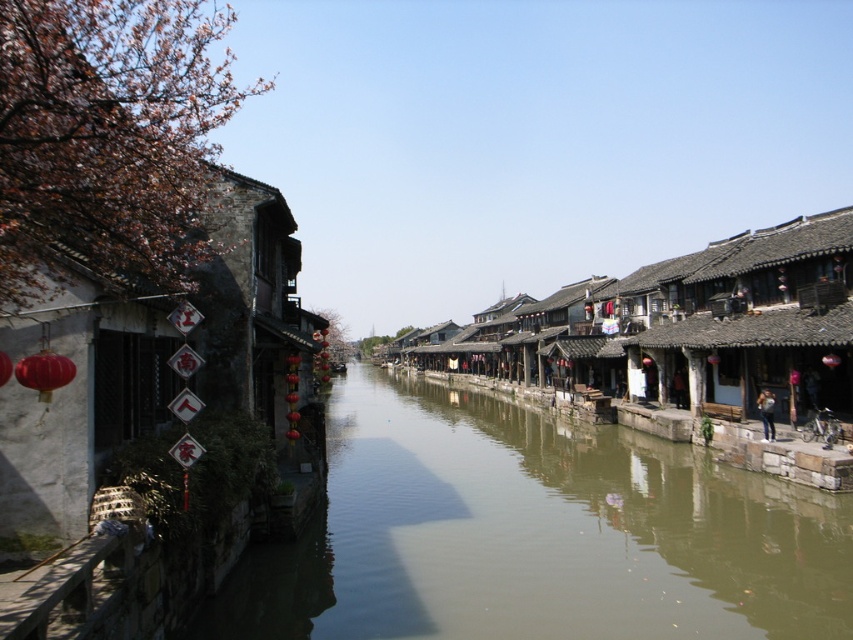
Question: Observing the image, what is the correct spatial positioning of greenish-brown water at center in reference to rustic wooden hut at center?

Choices:
 (A) below
 (B) above

Answer: (A)

Question: Which of the following is the closest to the observer?

Choices:
 (A) (436, 529)
 (B) (714, 316)

Answer: (A)

Question: Which point is farther to the camera?

Choices:
 (A) rustic wooden hut at center
 (B) greenish-brown water at center

Answer: (A)

Question: Observing the image, what is the correct spatial positioning of greenish-brown water at center in reference to rustic wooden hut at center?

Choices:
 (A) left
 (B) right

Answer: (A)

Question: Which object is farther from the camera taking this photo?

Choices:
 (A) rustic wooden hut at center
 (B) greenish-brown water at center

Answer: (A)

Question: Considering the relative positions of greenish-brown water at center and rustic wooden hut at center in the image provided, where is greenish-brown water at center located with respect to rustic wooden hut at center?

Choices:
 (A) right
 (B) left

Answer: (B)